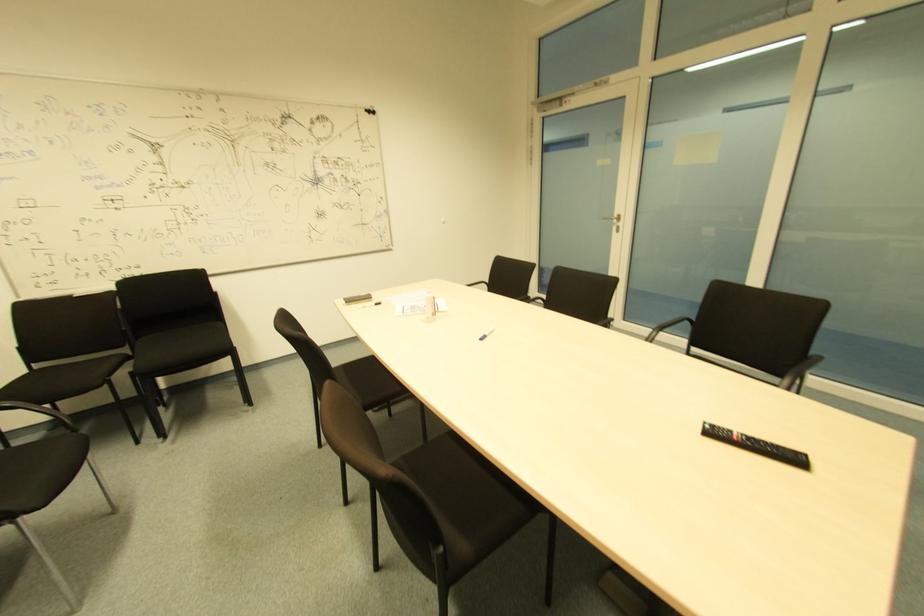
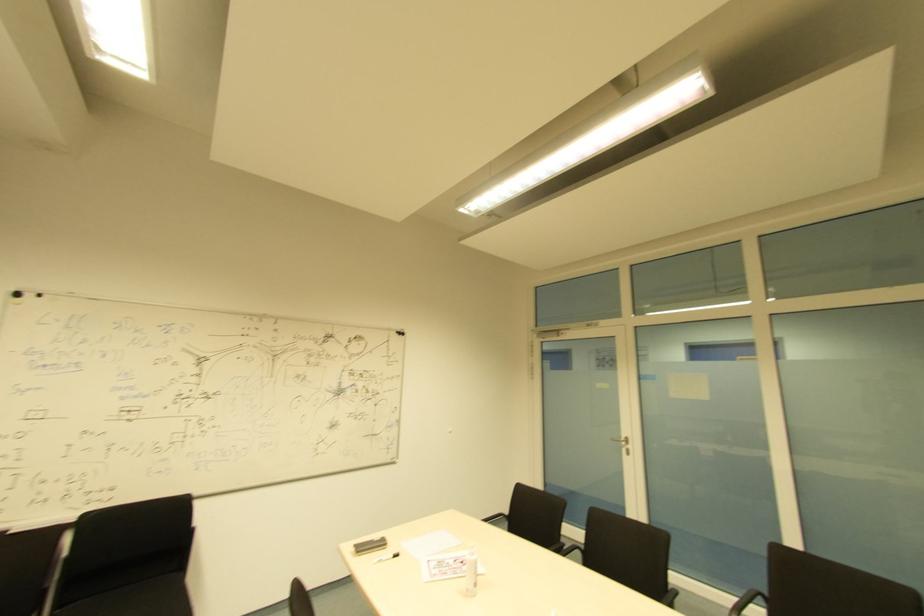
Where in the second image is the point corresponding to point (691, 322) from the first image?

(766, 599)